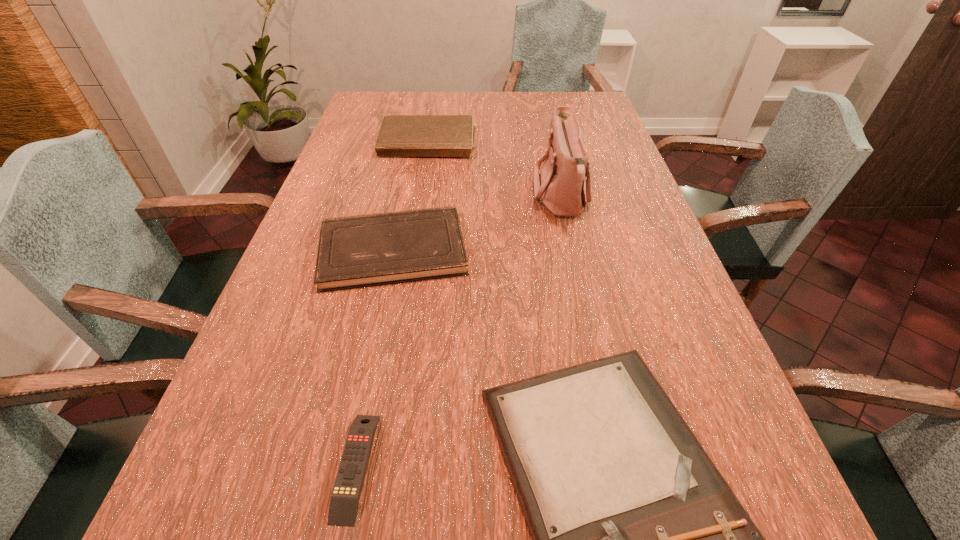
This screenshot has width=960, height=540. I want to click on free space between the remote control and the nearer paperback book, so click(374, 358).

In order to click on vacant space in between the remote control and the shoulder bag in this screenshot , I will do `click(458, 332)`.

Find the location of a particular element. This screenshot has height=540, width=960. empty space that is in between the fourth shortest object and the tallest object is located at coordinates (494, 172).

Locate which object is the fourth closest to the clipboard. Please provide its 2D coordinates. Your answer should be formatted as a tuple, i.e. [(x, y)], where the tuple contains the x and y coordinates of a point satisfying the conditions above.

[(400, 135)]

Identify which object is the second nearest to the remote control. Please provide its 2D coordinates. Your answer should be formatted as a tuple, i.e. [(x, y)], where the tuple contains the x and y coordinates of a point satisfying the conditions above.

[(368, 250)]

This screenshot has height=540, width=960. Identify the location of free space in the image that satisfies the following two spatial constraints: 1. on the front pocket of the tallest object; 2. on the front side of the third tallest object. (572, 250).

Identify the location of free space that satisfies the following two spatial constraints: 1. on the front pocket of the shoulder bag; 2. on the front side of the remote control. Image resolution: width=960 pixels, height=540 pixels. (621, 466).